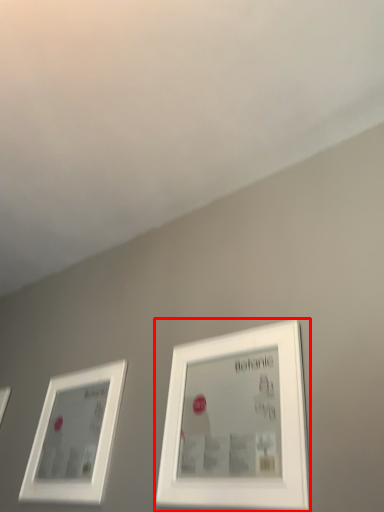
Question: Observing the image, what is the correct spatial positioning of picture frame (annotated by the red box) in reference to picture frame?

Choices:
 (A) right
 (B) left

Answer: (A)